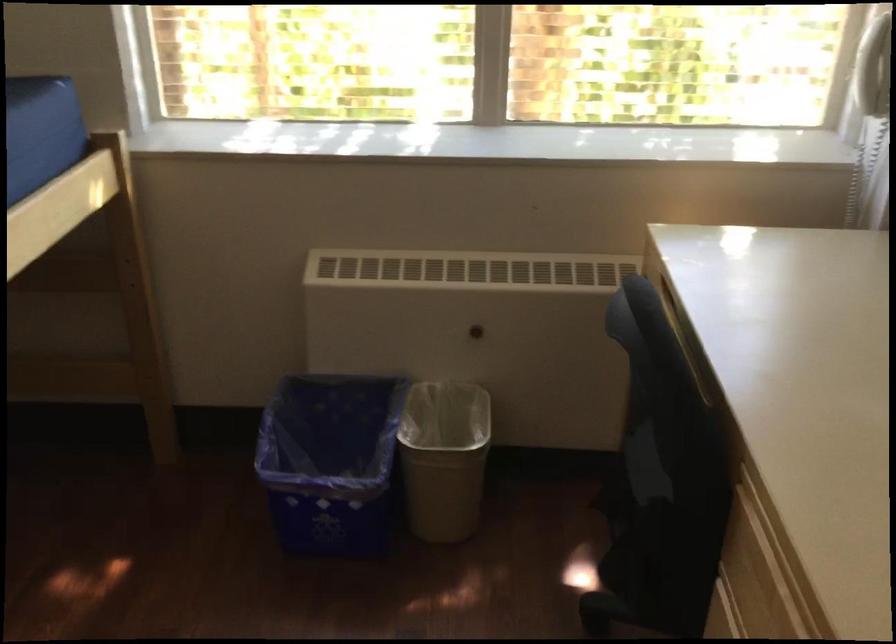
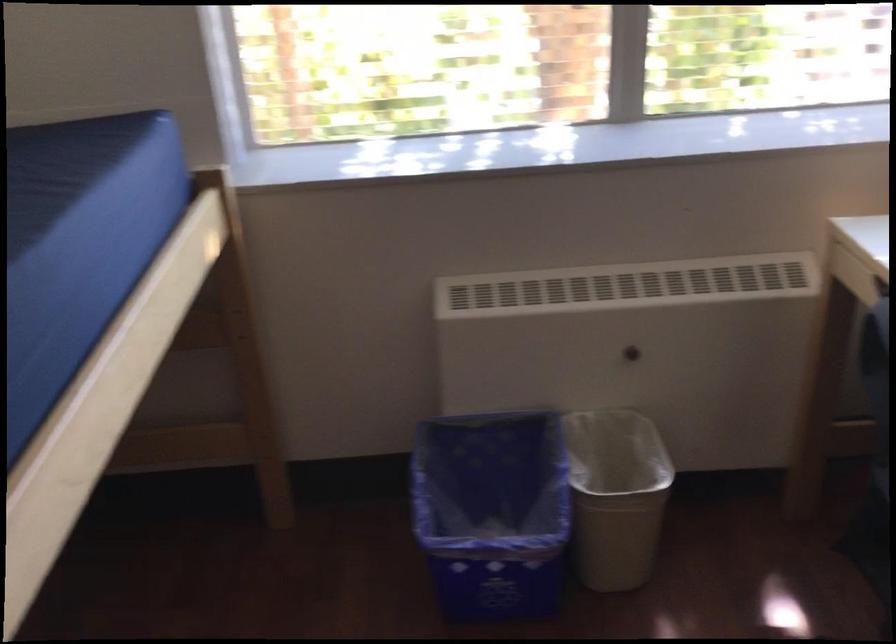
Find the pixel in the second image that matches pixel 431 451 in the first image.

(616, 496)